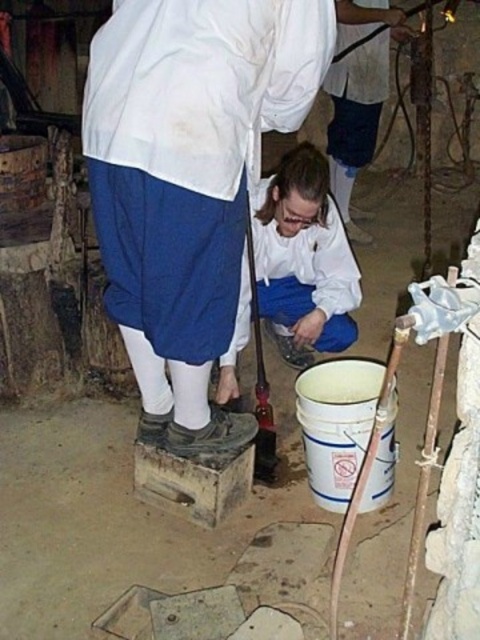
In the scene shown: You are an observer standing in front of the scene. You notice the blue cotton skirt at center and the white fabric shirt at upper center. Which object is positioned lower in the image?

The blue cotton skirt at center is located below the white fabric shirt at upper center, so it is positioned lower in the image.

You are standing in the workshop and need to locate the blue cotton skirt at center. According to the coordinates provided, where exactly is the blue cotton skirt positioned in the image?

The blue cotton skirt at center is positioned at coordinates point 0.281 on the x axis and point 0.394 on the y axis.